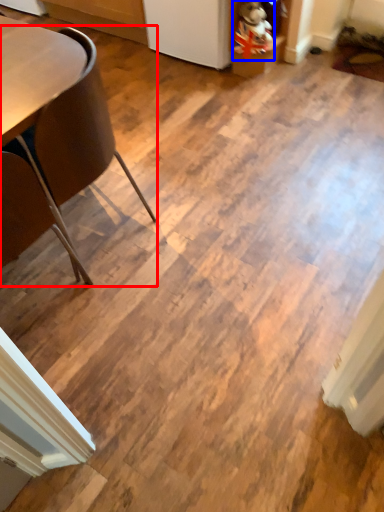
Question: Among these objects, which one is nearest to the camera, chair (highlighted by a red box) or toy (highlighted by a blue box)?

Choices:
 (A) chair
 (B) toy

Answer: (A)